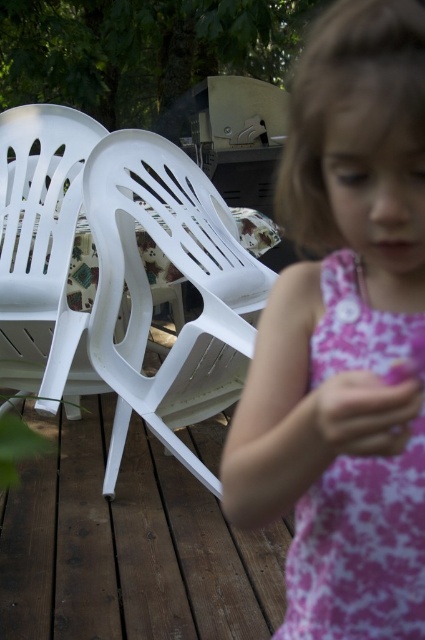
Question: Which point is farther to the camera?

Choices:
 (A) white plastic chair at center
 (B) pink floral dress at center

Answer: (A)

Question: Is pink floral dress at right smaller than white plastic chair at left?

Choices:
 (A) yes
 (B) no

Answer: (A)

Question: Which point is farther to the camera?

Choices:
 (A) pos(48,308)
 (B) pos(359,220)
 (C) pos(306,630)

Answer: (A)

Question: Does pink floral dress at right have a larger size compared to white plastic chair at center?

Choices:
 (A) yes
 (B) no

Answer: (B)

Question: Does pink floral dress at right have a smaller size compared to white plastic chair at center?

Choices:
 (A) no
 (B) yes

Answer: (B)

Question: Which of the following is the farthest from the observer?

Choices:
 (A) (201, 268)
 (B) (8, 240)
 (C) (357, 342)
 (D) (350, 476)

Answer: (B)